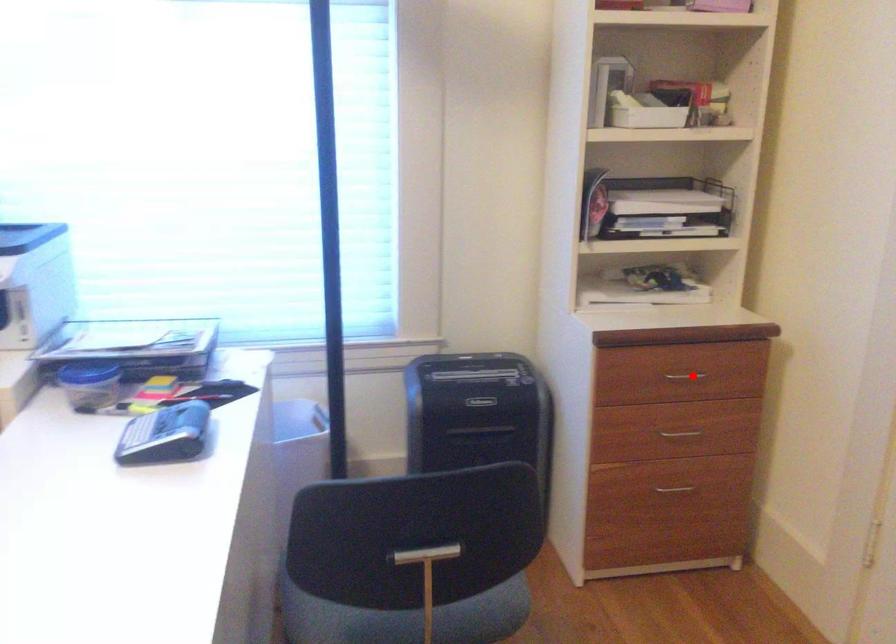
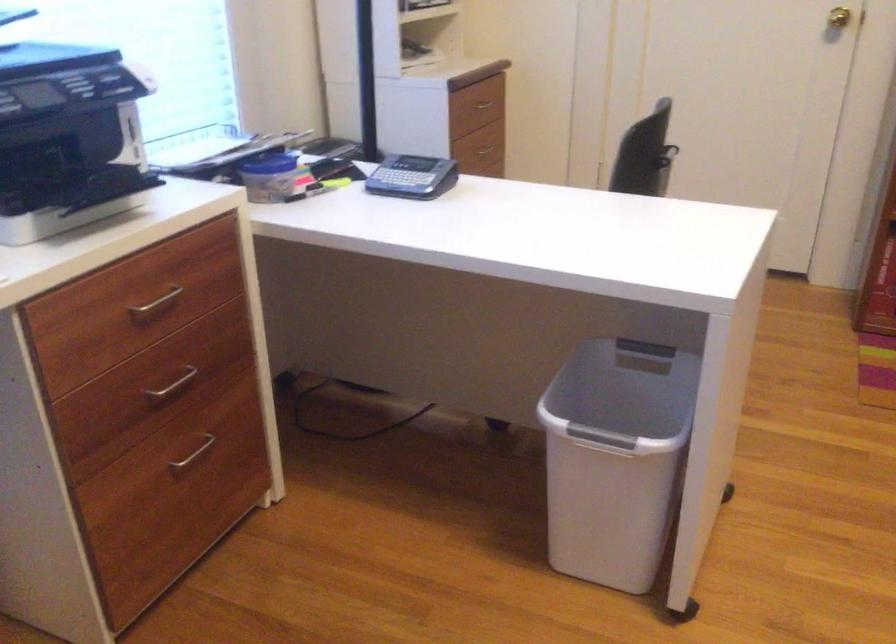
Question: I am providing you with two images of the same scene from different viewpoints. Image1 has a red point marked. In image2, the corresponding 3D location appears at what relative position? Reply with the corresponding letter.

Choices:
 (A) Closer
 (B) Farther

Answer: (B)